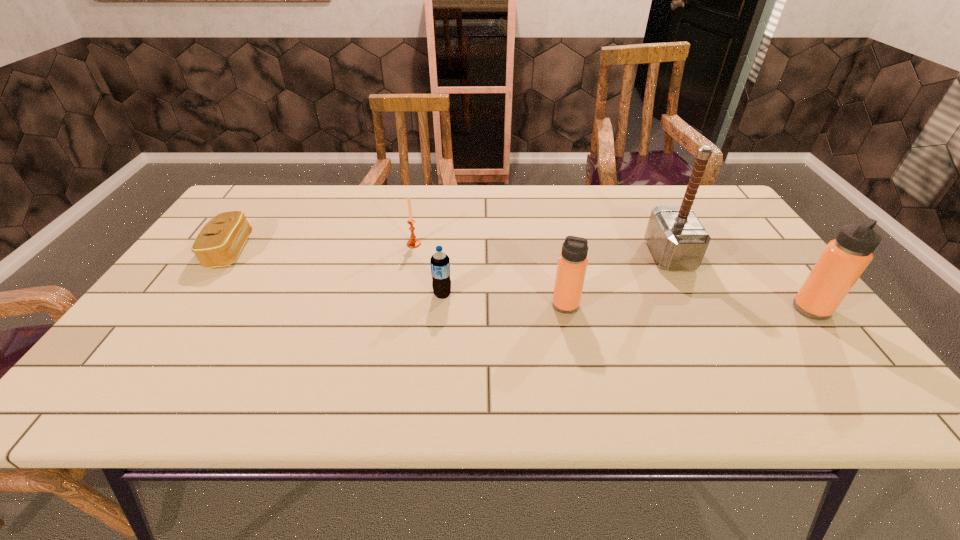
Considering the uniform spacing of thermos bottles, where should an additional thermos bottle be positioned on the left? Please locate a free spot. Please provide its 2D coordinates. Your answer should be formatted as a tuple, i.e. [(x, y)], where the tuple contains the x and y coordinates of a point satisfying the conditions above.

[(324, 301)]